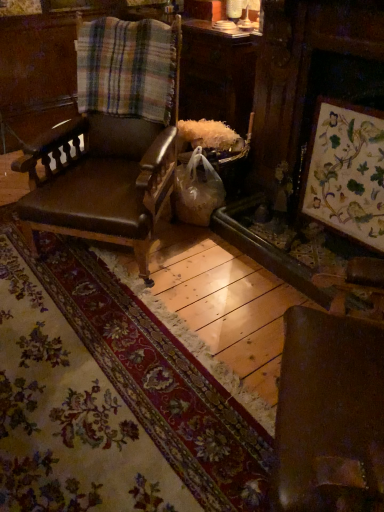
Question: From the image's perspective, is wooden floral artwork at right on brown leather chair at center?

Choices:
 (A) no
 (B) yes

Answer: (A)

Question: Can you confirm if wooden floral artwork at right is smaller than brown leather chair at center?

Choices:
 (A) no
 (B) yes

Answer: (B)

Question: Are wooden floral artwork at right and brown leather chair at center far apart?

Choices:
 (A) no
 (B) yes

Answer: (A)

Question: Does wooden floral artwork at right have a larger size compared to brown leather chair at center?

Choices:
 (A) yes
 (B) no

Answer: (B)

Question: Is the position of wooden floral artwork at right more distant than that of brown leather chair at center?

Choices:
 (A) yes
 (B) no

Answer: (A)

Question: Based on their positions, is wooden floral artwork at right located to the left or right of brown leather chair at center?

Choices:
 (A) left
 (B) right

Answer: (B)

Question: From the image's perspective, is wooden floral artwork at right above or below brown leather chair at center?

Choices:
 (A) above
 (B) below

Answer: (B)

Question: Is wooden floral artwork at right bigger or smaller than brown leather chair at center?

Choices:
 (A) small
 (B) big

Answer: (A)

Question: Is point (332, 201) positioned closer to the camera than point (87, 173)?

Choices:
 (A) farther
 (B) closer

Answer: (B)

Question: In terms of size, does wooden floral artwork at right appear bigger or smaller than plaid fabric at upper left?

Choices:
 (A) small
 (B) big

Answer: (B)

Question: Is wooden floral artwork at right in front of or behind plaid fabric at upper left in the image?

Choices:
 (A) front
 (B) behind

Answer: (A)

Question: From the image's perspective, is wooden floral artwork at right above or below plaid fabric at upper left?

Choices:
 (A) above
 (B) below

Answer: (B)

Question: Is wooden floral artwork at right wider or thinner than plaid fabric at upper left?

Choices:
 (A) wide
 (B) thin

Answer: (B)

Question: Do you think plaid fabric at upper left is within brown leather chair at center, or outside of it?

Choices:
 (A) inside
 (B) outside

Answer: (A)

Question: From a real-world perspective, is plaid fabric at upper left above or below brown leather chair at center?

Choices:
 (A) above
 (B) below

Answer: (A)